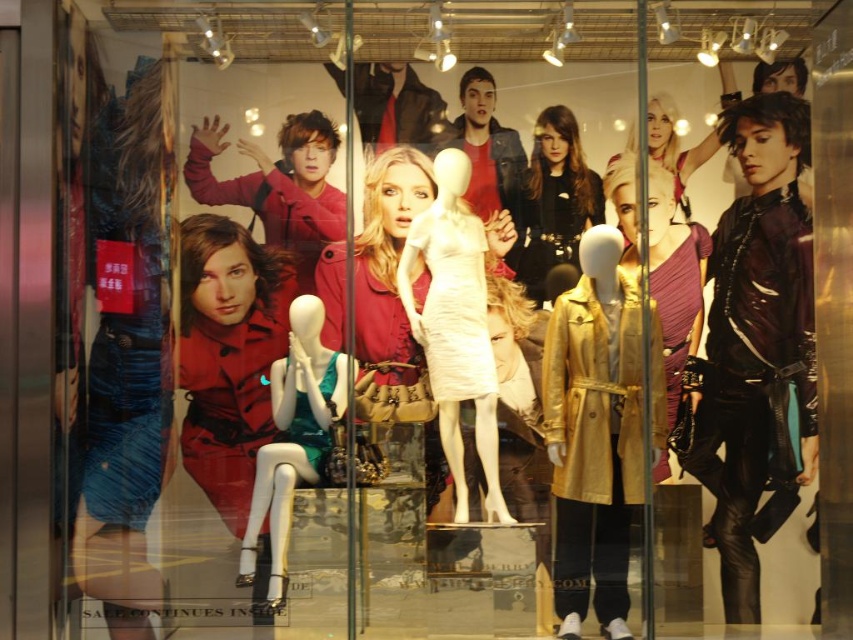
Between green shiny dress at center and matte gold coat at upper right, which one has less height?

With less height is matte gold coat at upper right.

Measure the distance between green shiny dress at center and matte gold coat at upper right.

A distance of 36.75 inches exists between green shiny dress at center and matte gold coat at upper right.

Does point (279, 429) come in front of point (688, 212)?

Yes, it is.

Find the location of a particular element. The height and width of the screenshot is (640, 853). green shiny dress at center is located at coordinates (293, 440).

Does metallic gold coat at center have a lesser width compared to white matte dress at center?

In fact, metallic gold coat at center might be wider than white matte dress at center.

This screenshot has width=853, height=640. Describe the element at coordinates (593, 433) in the screenshot. I see `metallic gold coat at center` at that location.

From the picture: Who is more distant from viewer, (660, 440) or (461, 388)?

The point (660, 440) is behind.

Identify the location of metallic gold coat at center. (593, 433).

Is point (636, 449) in front of point (665, 163)?

That is True.

Who is positioned more to the left, metallic gold coat at center or matte gold coat at upper right?

metallic gold coat at center

Where is `metallic gold coat at center`? metallic gold coat at center is located at coordinates (593, 433).